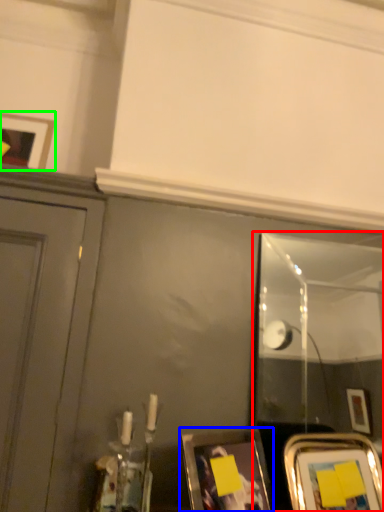
Question: Which object is the farthest from mirror (highlighted by a red box)? Choose among these: picture frame (highlighted by a blue box) or picture frame (highlighted by a green box).

Choices:
 (A) picture frame
 (B) picture frame

Answer: (B)